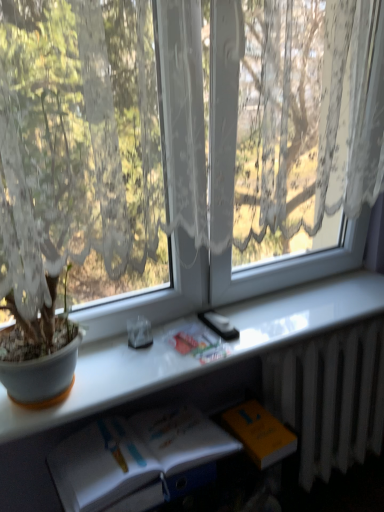
Question: Is transparent lace curtain at upper center not inside white metallic radiator at lower right?

Choices:
 (A) yes
 (B) no

Answer: (A)

Question: Is transparent lace curtain at upper center turned away from white metallic radiator at lower right?

Choices:
 (A) no
 (B) yes

Answer: (A)

Question: Does transparent lace curtain at upper center lie in front of white metallic radiator at lower right?

Choices:
 (A) no
 (B) yes

Answer: (B)

Question: Considering the relative sizes of transparent lace curtain at upper center and white metallic radiator at lower right in the image provided, is transparent lace curtain at upper center thinner than white metallic radiator at lower right?

Choices:
 (A) yes
 (B) no

Answer: (B)

Question: From the image's perspective, is transparent lace curtain at upper center on white metallic radiator at lower right?

Choices:
 (A) yes
 (B) no

Answer: (A)

Question: Looking at their shapes, would you say orange matte paperback book at lower right is wider or thinner than white paper book at lower center, acting as the 1th book starting from the bottom?

Choices:
 (A) wide
 (B) thin

Answer: (B)

Question: From the image's perspective, is orange matte paperback book at lower right positioned above or below white paper book at lower center, acting as the 1th book starting from the bottom?

Choices:
 (A) below
 (B) above

Answer: (B)

Question: Does point (258, 421) appear closer or farther from the camera than point (168, 493)?

Choices:
 (A) farther
 (B) closer

Answer: (A)

Question: Visually, is orange matte paperback book at lower right positioned to the left or to the right of white paper book at lower center, positioned as the second book in top-to-bottom order?

Choices:
 (A) left
 (B) right

Answer: (B)

Question: Is point pos(137,473) positioned closer to the camera than point pos(311,361)?

Choices:
 (A) farther
 (B) closer

Answer: (B)

Question: Relative to white metallic radiator at lower right, is white paper book at lower center, acting as the 1th book starting from the bottom, in front or behind?

Choices:
 (A) front
 (B) behind

Answer: (A)

Question: From the image's perspective, relative to white metallic radiator at lower right, is white paper book at lower center, acting as the 1th book starting from the bottom, above or below?

Choices:
 (A) below
 (B) above

Answer: (A)

Question: Is white paper book at lower center, positioned as the second book in top-to-bottom order, spatially inside white metallic radiator at lower right, or outside of it?

Choices:
 (A) inside
 (B) outside

Answer: (B)

Question: Is point pyautogui.click(x=8, y=246) positioned closer to the camera than point pyautogui.click(x=301, y=463)?

Choices:
 (A) closer
 (B) farther

Answer: (A)

Question: Visually, is transparent lace curtain at upper center positioned to the left or to the right of white metallic radiator at lower right?

Choices:
 (A) left
 (B) right

Answer: (A)